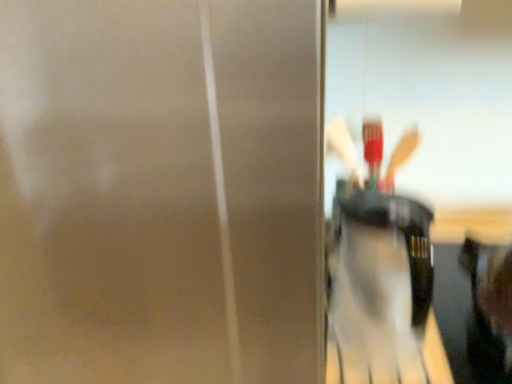
The height and width of the screenshot is (384, 512). Identify the location of matte silver screen door at center. (161, 191).

How many degrees apart are the facing directions of translucent plastic cup at center and matte silver screen door at center?

There is a 3.26-degree angle between the facing directions of translucent plastic cup at center and matte silver screen door at center.

How much distance is there between translucent plastic cup at center and matte silver screen door at center?

They are 21.94 inches apart.

Locate an element on the screen. Image resolution: width=512 pixels, height=384 pixels. table on the right of matte silver screen door at center is located at coordinates (452, 308).

Does point (467, 376) come closer to viewer compared to point (318, 320)?

No, it is not.

Is smooth black hair at right wider or thinner than translucent plastic cup at center?

smooth black hair at right is wider than translucent plastic cup at center.

Is translucent plastic cup at center at the back of smooth black hair at right?

smooth black hair at right is not turned away from translucent plastic cup at center.

Considering the positions of objects smooth black hair at right and translucent plastic cup at center in the image provided, who is more to the right, smooth black hair at right or translucent plastic cup at center?

From the viewer's perspective, smooth black hair at right appears more on the right side.

Considering the sizes of smooth black hair at right and translucent plastic cup at center in the image, is smooth black hair at right bigger or smaller than translucent plastic cup at center?

In the image, smooth black hair at right appears to be larger than translucent plastic cup at center.

Is smooth black hair at right taller or shorter than matte silver screen door at center?

Clearly, smooth black hair at right is shorter compared to matte silver screen door at center.

Does smooth black hair at right have a larger size compared to matte silver screen door at center?

Incorrect, smooth black hair at right is not larger than matte silver screen door at center.

In the scene shown: Can you confirm if smooth black hair at right is thinner than matte silver screen door at center?

Correct, the width of smooth black hair at right is less than that of matte silver screen door at center.

Which is in front, point (486, 283) or point (96, 293)?

The point (96, 293) is closer to the camera.

From the picture: Which of these two, matte silver screen door at center or smooth black hair at right, is thinner?

Thinner between the two is smooth black hair at right.

From the image's perspective, is matte silver screen door at center over smooth black hair at right?

Actually, matte silver screen door at center appears below smooth black hair at right in the image.

Is matte silver screen door at center located outside smooth black hair at right?

Yes, matte silver screen door at center is outside of smooth black hair at right.

Which is closer to the camera, (234, 309) or (470, 321)?

The point (234, 309) is in front.

Is matte silver screen door at center inside the boundaries of translucent plastic cup at center, or outside?

matte silver screen door at center lies outside translucent plastic cup at center.

You are a GUI agent. You are given a task and a screenshot of the screen. Output one action in this format:
    pyautogui.click(x=<x>, y=<y>)
    Task: Click on the screen door on the left of translucent plastic cup at center
    
    Given the screenshot: What is the action you would take?
    pyautogui.click(x=161, y=191)

From the image's perspective, who appears lower, matte silver screen door at center or translucent plastic cup at center?

From the image's view, matte silver screen door at center is below.

Considering the relative positions of matte silver screen door at center and translucent plastic cup at center in the image provided, is matte silver screen door at center to the right of translucent plastic cup at center from the viewer's perspective?

No, matte silver screen door at center is not to the right of translucent plastic cup at center.

Would you say translucent plastic cup at center is a long distance from smooth black hair at right?

No, there isn't a large distance between translucent plastic cup at center and smooth black hair at right.

Could you tell me if translucent plastic cup at center is turned towards smooth black hair at right?

No.

From the image's perspective, does translucent plastic cup at center appear higher than smooth black hair at right?

No, from the image's perspective, translucent plastic cup at center is not on top of smooth black hair at right.

Which is behind, translucent plastic cup at center or smooth black hair at right?

translucent plastic cup at center.

The image size is (512, 384). Identify the location of table that appears above the matte silver screen door at center (from the image's perspective). (452, 308).

Image resolution: width=512 pixels, height=384 pixels. In order to click on table behind the smooth black hair at right in this screenshot , I will do pos(452,308).

From the image, which object appears to be farther from smooth black hair at right, translucent plastic cup at center or matte silver screen door at center?

The object further to smooth black hair at right is matte silver screen door at center.

Which object lies nearer to the anchor point matte silver screen door at center, translucent plastic cup at center or smooth black hair at right?

smooth black hair at right is closer to matte silver screen door at center.

Estimate the real-world distances between objects in this image. Which object is closer to smooth black hair at right, matte silver screen door at center or translucent plastic cup at center?

translucent plastic cup at center is closer to smooth black hair at right.

Considering their positions, is smooth black hair at right positioned closer to translucent plastic cup at center than matte silver screen door at center?

Based on the image, smooth black hair at right appears to be nearer to translucent plastic cup at center.

Looking at the image, which one is located closer to translucent plastic cup at center, matte silver screen door at center or smooth black hair at right?

Among the two, smooth black hair at right is located nearer to translucent plastic cup at center.

Estimate the real-world distances between objects in this image. Which object is closer to matte silver screen door at center, smooth black hair at right or translucent plastic cup at center?

smooth black hair at right is positioned closer to the anchor matte silver screen door at center.

Where is `table between matte silver screen door at center and smooth black hair at right from left to right`? The height and width of the screenshot is (384, 512). table between matte silver screen door at center and smooth black hair at right from left to right is located at coordinates (452, 308).